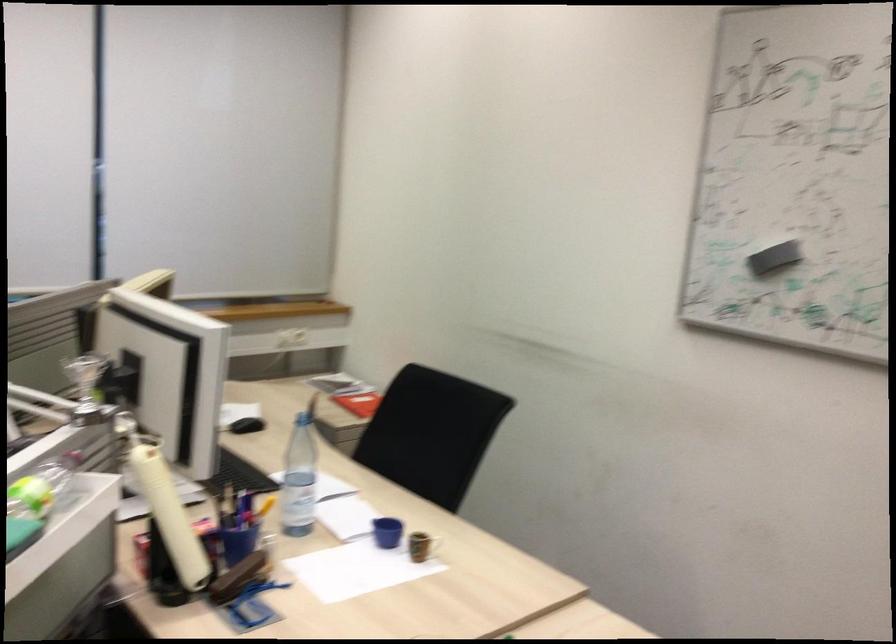
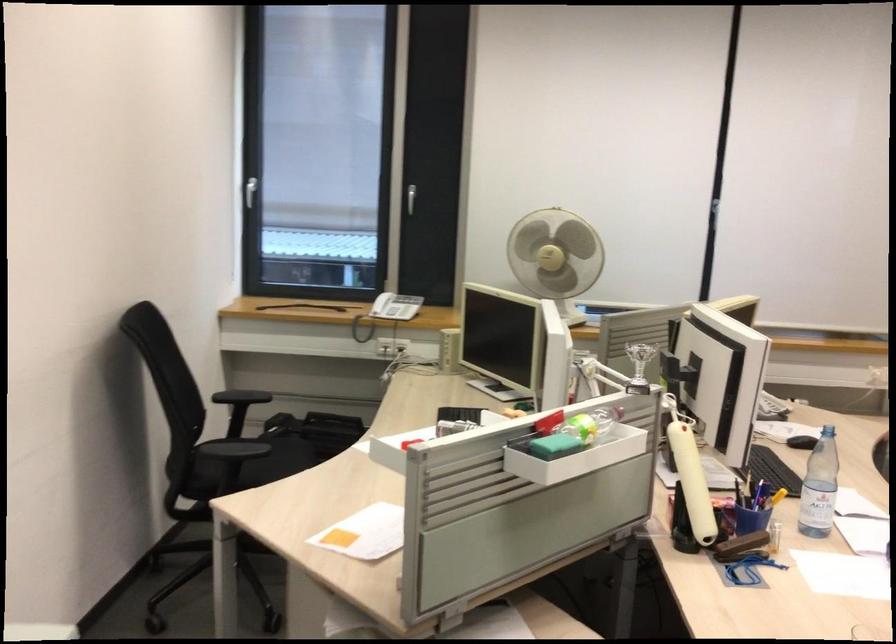
The point at (x=295, y=480) is marked in the first image. Where is the corresponding point in the second image?

(819, 487)